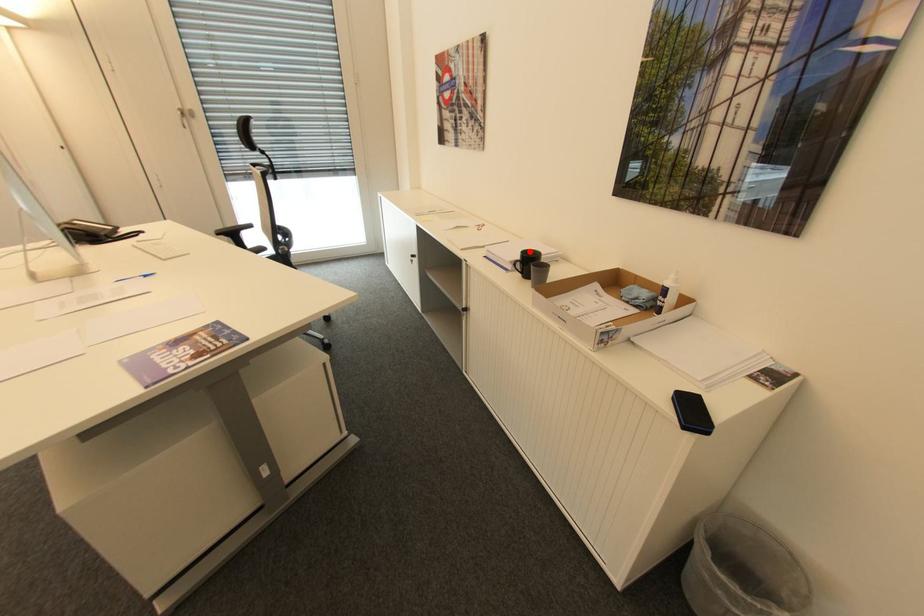
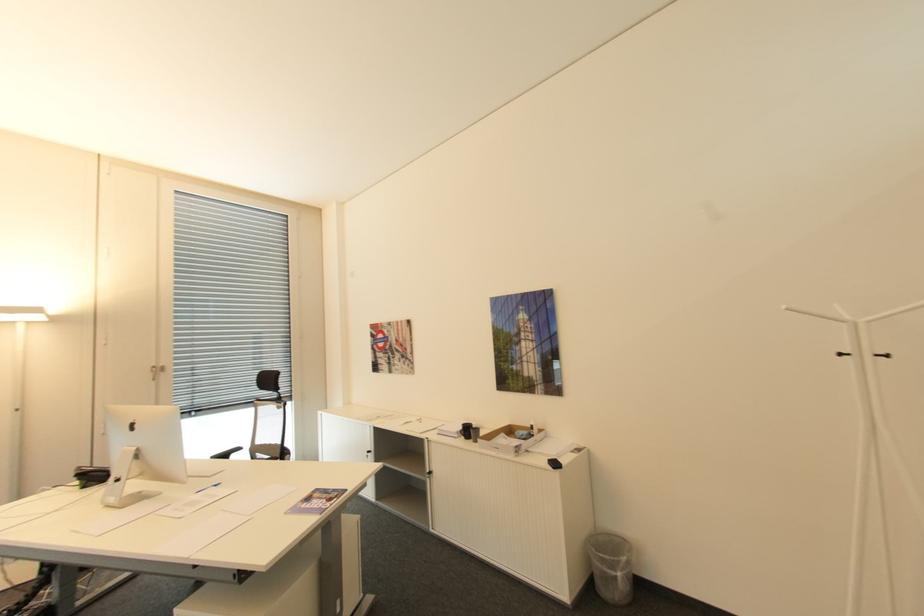
Find the pixel in the second image that matches the highlighted location in the first image.

(468, 424)